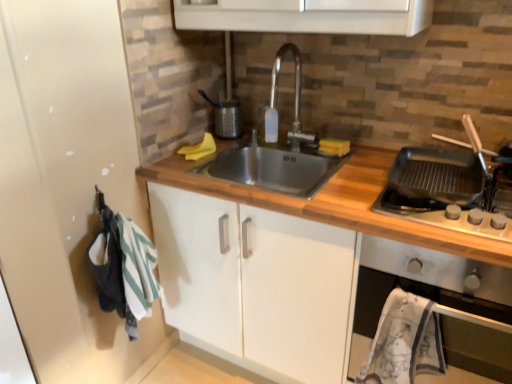
Identify the location of unoccupied region to the right of satin nickel faucet at center. (356, 150).